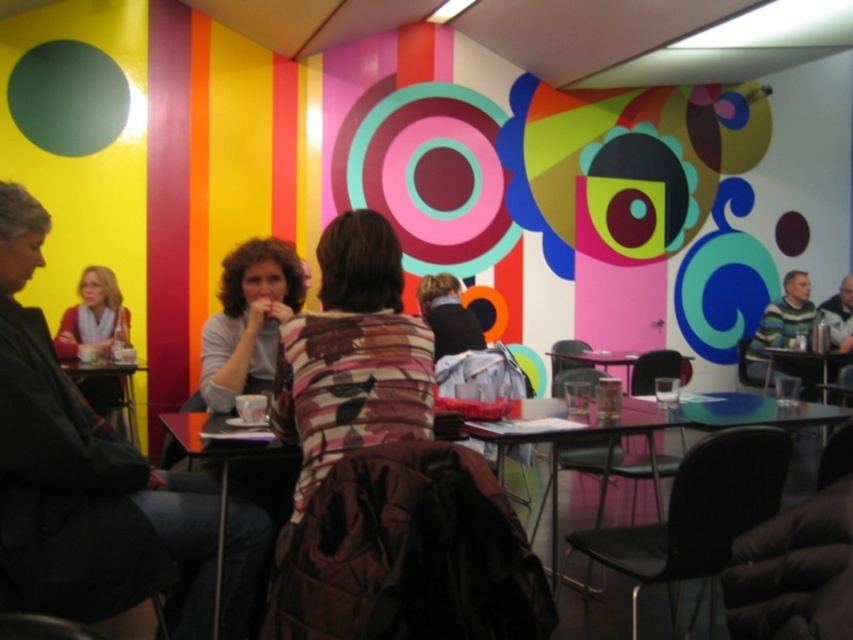
You are a customer looking for a table to sit at in the vibrant indoor setting. You prefer a table that can accommodate a group of four people comfortably. Which table, the matte black table at center or the wooden table at center, would you choose based on their sizes?

The matte black table at center has a larger size compared to the wooden table at center, so you should choose the matte black table at center to accommodate a group of four people comfortably.

You are sitting at a table in the vibrant indoor setting described. You notice a white sweater at left. Can you determine its exact location using the coordinate system provided?

The white sweater at left is located at point (93,316) in the coordinate system.